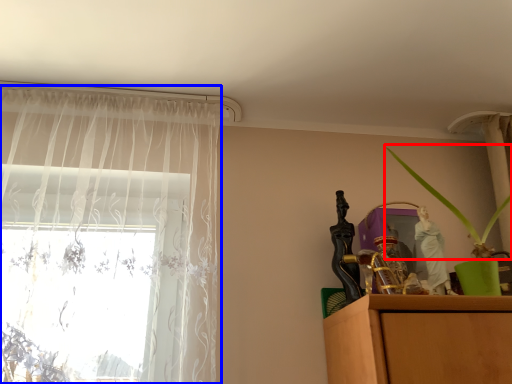
Question: Which object appears closest to the camera in this image, plant (highlighted by a red box) or curtain (highlighted by a blue box)?

Choices:
 (A) plant
 (B) curtain

Answer: (A)